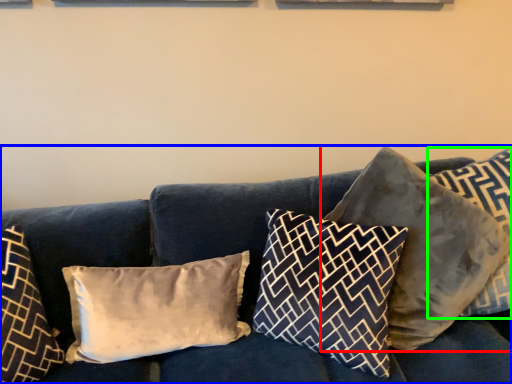
Question: Which is nearer to the pillow (highlighted by a red box)? studio couch (highlighted by a blue box) or pillow (highlighted by a green box).

Choices:
 (A) studio couch
 (B) pillow

Answer: (B)